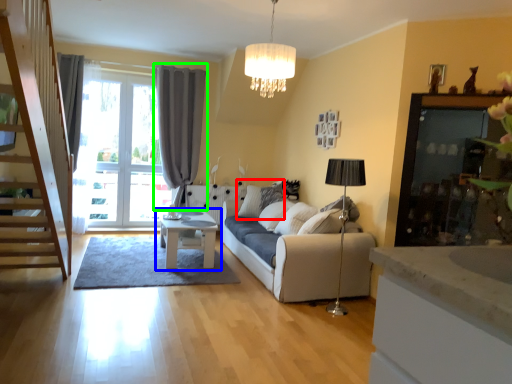
Question: Considering the real-world distances, which object is closest to pillow (highlighted by a red box)? table (highlighted by a blue box) or curtain (highlighted by a green box).

Choices:
 (A) table
 (B) curtain

Answer: (A)